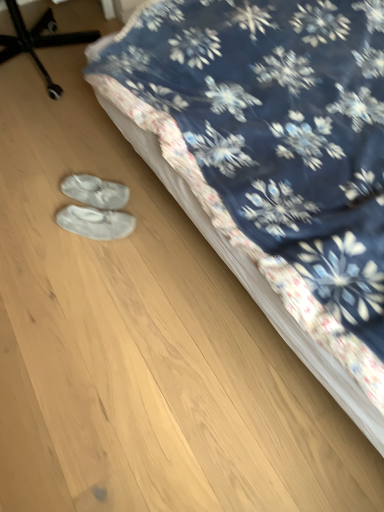
Find the location of a particular element. The image size is (384, 512). free region under black plastic chair at upper left (from a real-world perspective) is located at coordinates (35, 66).